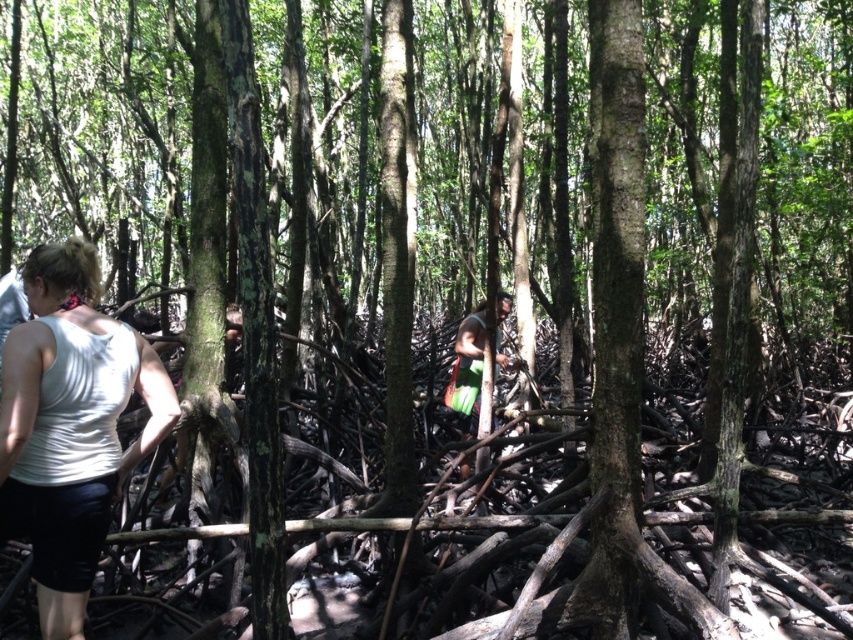
Can you confirm if white fabric at left is wider than green fabric bag at center?

Indeed, white fabric at left has a greater width compared to green fabric bag at center.

Between white fabric at left and green fabric bag at center, which one has less height?

white fabric at left is shorter.

Which is in front, point (38, 611) or point (474, 316)?

Point (38, 611) is in front.

Where is `white fabric at left`? The image size is (853, 640). white fabric at left is located at coordinates (70, 426).